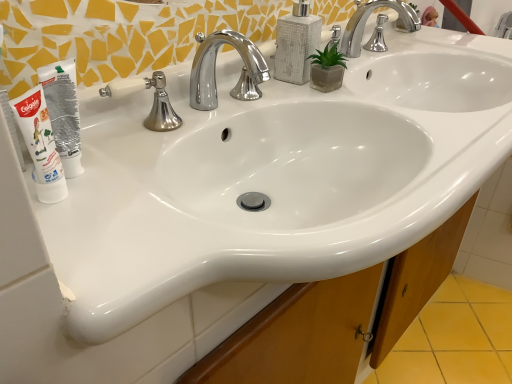
Where is `free space behind chrome/metallic faucet at upper center, positioned as the 2th tap in front-to-back order`? free space behind chrome/metallic faucet at upper center, positioned as the 2th tap in front-to-back order is located at coordinates [376, 58].